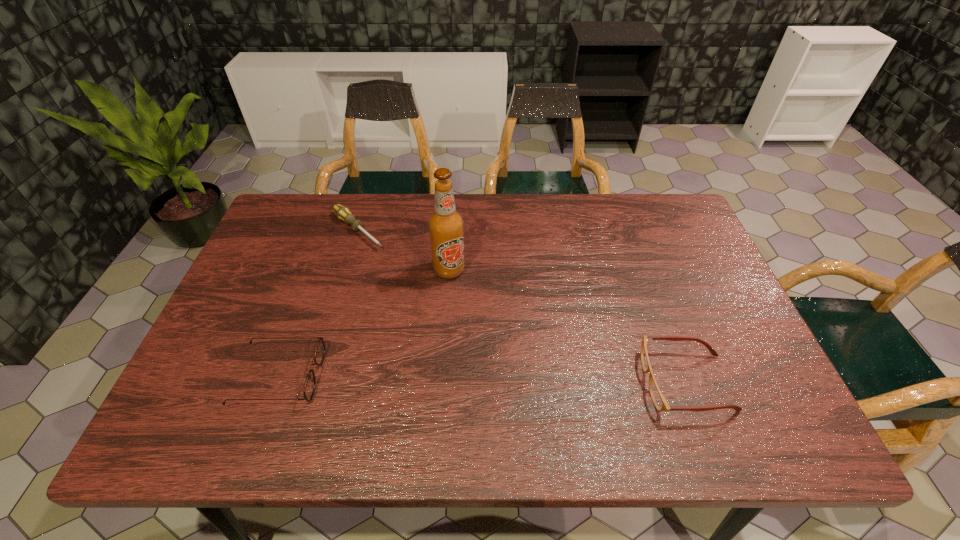
The image size is (960, 540). In order to click on empty location between the second farthest object and the sunglasses in this screenshot , I will do `click(365, 323)`.

You are a GUI agent. You are given a task and a screenshot of the screen. Output one action in this format:
    pyautogui.click(x=<x>, y=<y>)
    Task: Click on the free space between the sunglasses and the farthest object
    The width and height of the screenshot is (960, 540).
    Given the screenshot: What is the action you would take?
    pyautogui.click(x=319, y=303)

Identify the location of free spot between the rightmost object and the tallest object. This screenshot has width=960, height=540. (567, 326).

The width and height of the screenshot is (960, 540). Identify the location of free space that is in between the sunglasses and the third nearest object. (365, 323).

Image resolution: width=960 pixels, height=540 pixels. Identify the location of free space between the spectacles and the sunglasses. (483, 379).

Where is `vacant space that's between the farthest object and the sunglasses`? vacant space that's between the farthest object and the sunglasses is located at coordinates (319, 303).

Find the location of a particular element. The width and height of the screenshot is (960, 540). vacant area that lies between the second farthest object and the farthest object is located at coordinates (403, 251).

Image resolution: width=960 pixels, height=540 pixels. What are the coordinates of `free space between the spectacles and the shortest object` in the screenshot? It's located at (522, 307).

The width and height of the screenshot is (960, 540). In order to click on free space between the shortest object and the tallest object in this screenshot , I will do `click(403, 251)`.

I want to click on object that can be found as the second closest to the tallest object, so click(x=309, y=388).